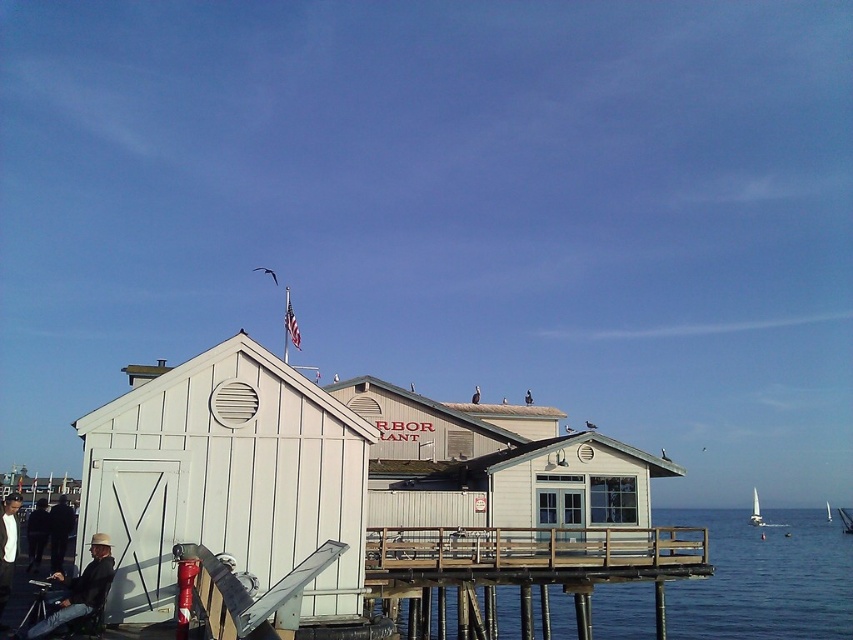
You are standing on the wooden deck of the coastal building and want to place a 1.5 meter wide picnic blanket. The transparent blue water at lower center and the dark gray jacket at lower left are in your way. Which area can accommodate the blanket without overlapping the objects?

The transparent blue water at lower center might be wider than dark gray jacket at lower left, so the transparent blue water at lower center is more likely to accommodate the 1.5 meter wide picnic blanket without overlapping the objects.

You are standing at the origin point in the coastal scene. The white wood beach hut at left is marked at coordinates. Can you determine its exact location based on the coordinates provided?

The white wood beach hut at left is located at point (225, 477).